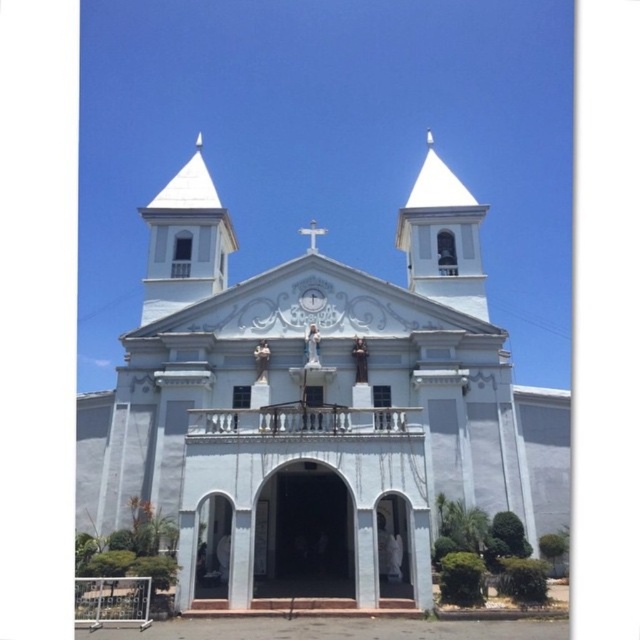
Who is shorter, white marble bell tower at upper center or white marble cross at center?

white marble cross at center is shorter.

Does white marble bell tower at upper center appear over white marble cross at center?

Yes, white marble bell tower at upper center is above white marble cross at center.

Is point (468, 218) positioned after point (312, 232)?

Yes.

Locate an element on the screen. white marble bell tower at upper center is located at coordinates (442, 237).

Between point (316, 307) and point (323, 227), which one is positioned behind?

Point (323, 227)

From the picture: Which is more to the right, white marble clock at center or white marble cross at center?

From the viewer's perspective, white marble clock at center appears more on the right side.

Which is behind, point (310, 305) or point (308, 244)?

The point (308, 244) is behind.

Where is `white marble clock at center`? The image size is (640, 640). white marble clock at center is located at coordinates (312, 300).

Between white marble bell tower at upper center and white marble clock at center, which one has more height?

Standing taller between the two is white marble bell tower at upper center.

Between white marble bell tower at upper center and white marble clock at center, which one is positioned lower?

white marble clock at center is lower down.

Describe the element at coordinates (442, 237) in the screenshot. I see `white marble bell tower at upper center` at that location.

The width and height of the screenshot is (640, 640). Find the location of `white marble bell tower at upper center`. white marble bell tower at upper center is located at coordinates coord(442,237).